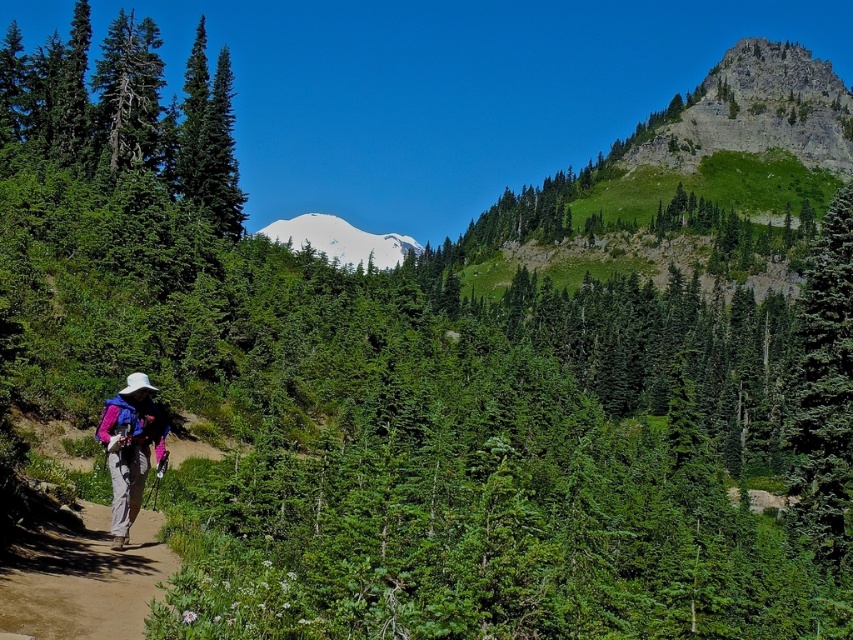
Can you confirm if brown dirt path at lower left is taller than pink fabric backpack at lower left?

In fact, brown dirt path at lower left may be shorter than pink fabric backpack at lower left.

Is brown dirt path at lower left bigger than pink fabric backpack at lower left?

Incorrect, brown dirt path at lower left is not larger than pink fabric backpack at lower left.

Image resolution: width=853 pixels, height=640 pixels. What do you see at coordinates (83, 579) in the screenshot?
I see `brown dirt path at lower left` at bounding box center [83, 579].

I want to click on brown dirt path at lower left, so click(x=83, y=579).

Is green textured tree at right positioned behind pink fabric backpack at lower left?

Yes, green textured tree at right is behind pink fabric backpack at lower left.

Find the location of a particular element. green textured tree at right is located at coordinates (822, 388).

Measure the distance between green textured tree at right and brown dirt path at lower left.

green textured tree at right is 46.03 meters from brown dirt path at lower left.

At what (x,y) coordinates should I click in order to perform the action: click on green textured tree at right. Please return your answer as a coordinate pair (x, y). The width and height of the screenshot is (853, 640). Looking at the image, I should click on (822, 388).

Identify the location of green textured tree at right. The width and height of the screenshot is (853, 640). (822, 388).